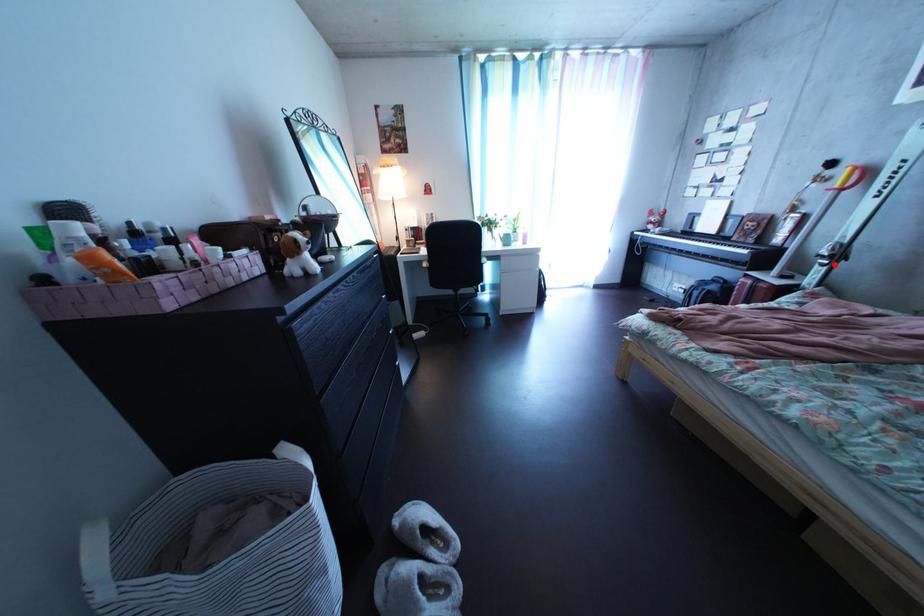
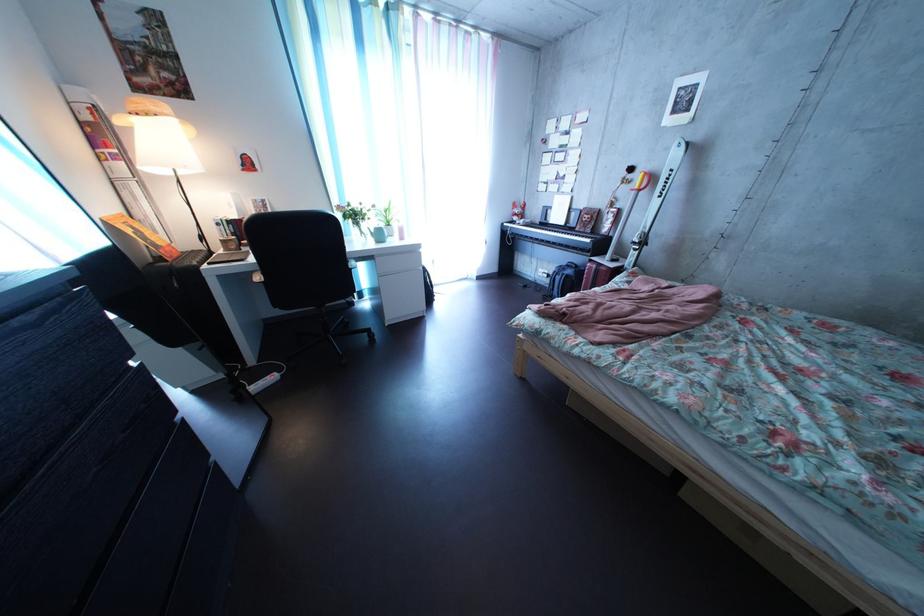
The point at the highlighted location is marked in the first image. Where is the corresponding point in the second image?

(648, 252)